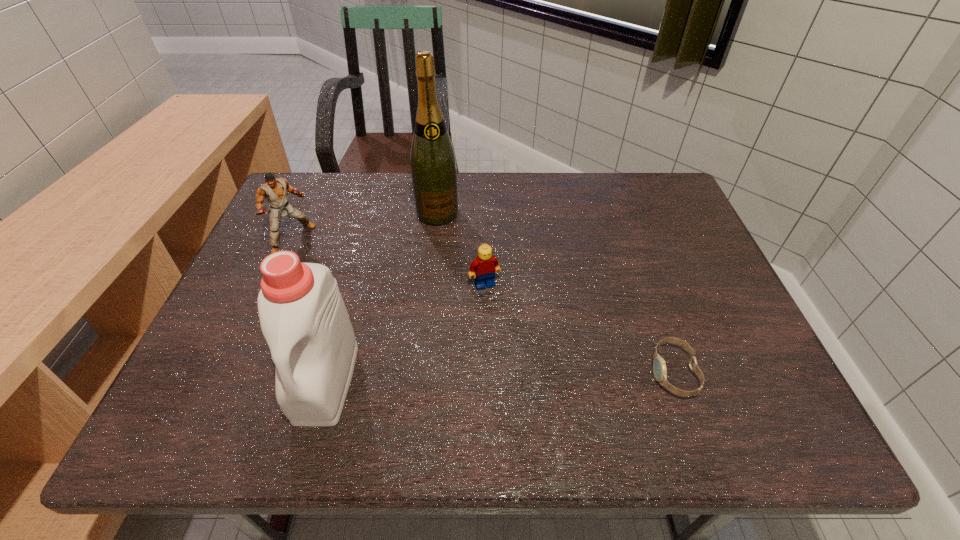
Locate an element on the screen. The image size is (960, 540). unoccupied area between the rightmost object and the wine bottle is located at coordinates (556, 293).

You are a GUI agent. You are given a task and a screenshot of the screen. Output one action in this format:
    pyautogui.click(x=<x>, y=<y>)
    Task: Click on the vacant area between the Lego and the rightmost object
    This screenshot has height=540, width=960.
    Given the screenshot: What is the action you would take?
    pyautogui.click(x=579, y=328)

You are a GUI agent. You are given a task and a screenshot of the screen. Output one action in this format:
    pyautogui.click(x=<x>, y=<y>)
    Task: Click on the vacant point located between the shortest object and the leftmost object
    The width and height of the screenshot is (960, 540).
    Given the screenshot: What is the action you would take?
    pyautogui.click(x=484, y=306)

Find the location of a particular element. free space between the second object from right to left and the tallest object is located at coordinates (461, 249).

Identify which object is the fourth closest to the second shortest object. Please provide its 2D coordinates. Your answer should be formatted as a tuple, i.e. [(x, y)], where the tuple contains the x and y coordinates of a point satisfying the conditions above.

[(275, 191)]

Choose which object is the fourth nearest neighbor to the shortest object. Please provide its 2D coordinates. Your answer should be formatted as a tuple, i.e. [(x, y)], where the tuple contains the x and y coordinates of a point satisfying the conditions above.

[(275, 191)]

Find the location of a particular element. The height and width of the screenshot is (540, 960). free space that satisfies the following two spatial constraints: 1. on the front side of the shortest object; 2. on the face of the third tallest object is located at coordinates (236, 373).

Where is `free space that satisfies the following two spatial constraints: 1. on the front side of the watch; 2. on the face of the second object from right to left`? The image size is (960, 540). free space that satisfies the following two spatial constraints: 1. on the front side of the watch; 2. on the face of the second object from right to left is located at coordinates (486, 373).

Identify the location of vacant region that satisfies the following two spatial constraints: 1. on the front side of the watch; 2. on the face of the leftmost object. (236, 373).

Find the location of a particular element. vacant point that satisfies the following two spatial constraints: 1. on the front side of the shortest object; 2. on the face of the third object from left to right is located at coordinates (420, 373).